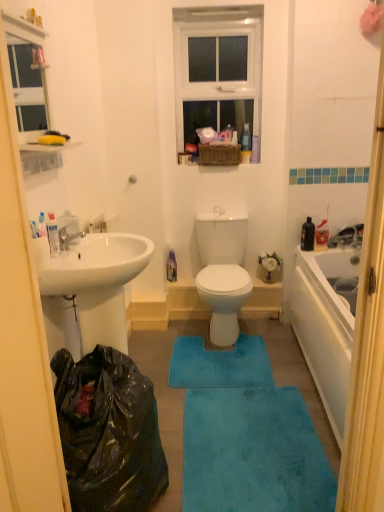
Where is `white plastic window at upper center`? This screenshot has width=384, height=512. white plastic window at upper center is located at coordinates (217, 70).

Looking at this image, measure the distance between black plastic bag at lower left and camera.

black plastic bag at lower left is 4.20 feet away from camera.

How much space does blue plush bath mat at center, which is the 1th bath mat in back-to-front order, occupy horizontally?

blue plush bath mat at center, which is the 1th bath mat in back-to-front order, is 22.28 inches wide.

What do you see at coordinates (220, 364) in the screenshot?
I see `blue plush bath mat at center, which is the 1th bath mat in back-to-front order` at bounding box center [220, 364].

Where is `white plastic window at upper center`? Image resolution: width=384 pixels, height=512 pixels. white plastic window at upper center is located at coordinates (217, 70).

Considering the sizes of objects clear glass window screen at upper left and white plastic toothpaste tube at left in the image provided, who is bigger, clear glass window screen at upper left or white plastic toothpaste tube at left?

clear glass window screen at upper left.

Between clear glass window screen at upper left and white plastic toothpaste tube at left, which one has smaller width?

clear glass window screen at upper left is thinner.

From the image's perspective, would you say clear glass window screen at upper left is shown under white plastic toothpaste tube at left?

Actually, clear glass window screen at upper left appears above white plastic toothpaste tube at left in the image.

Would you say clear glass window screen at upper left contains white plastic toothpaste tube at left?

Definitely not — white plastic toothpaste tube at left is not inside clear glass window screen at upper left.

Who is shorter, clear glass window screen at upper left or matte silver faucet at left?

matte silver faucet at left is shorter.

Based on their sizes in the image, would you say clear glass window screen at upper left is bigger or smaller than matte silver faucet at left?

Considering their sizes, clear glass window screen at upper left takes up more space than matte silver faucet at left.

Is clear glass window screen at upper left looking in the opposite direction of matte silver faucet at left?

No, clear glass window screen at upper left is not facing away from matte silver faucet at left.

Between clear glass window screen at upper left and matte silver faucet at left, which one is positioned in front?

clear glass window screen at upper left is in front.

Which is correct: black plastic bag at lower left is inside blue plush bath mat at center, which ranks as the second bath mat in bottom-to-top order, or outside of it?

black plastic bag at lower left lies outside blue plush bath mat at center, which ranks as the second bath mat in bottom-to-top order.

Considering their positions, is black plastic bag at lower left located in front of or behind blue plush bath mat at center, which appears as the 1th bath mat when viewed from the top?

black plastic bag at lower left is positioned closer to the viewer than blue plush bath mat at center, which appears as the 1th bath mat when viewed from the top.

Is black plastic bag at lower left turned away from blue plush bath mat at center, which is the 1th bath mat in back-to-front order?

black plastic bag at lower left is not turned away from blue plush bath mat at center, which is the 1th bath mat in back-to-front order.

Could you measure the distance between black plastic bag at lower left and blue plush bath mat at center, which is the 1th bath mat in back-to-front order?

black plastic bag at lower left and blue plush bath mat at center, which is the 1th bath mat in back-to-front order, are 31.87 inches apart from each other.

Between blue plush bath mat at center, the 1th bath mat when ordered from bottom to top, and black plastic bag at lower left, which one has more height?

With more height is black plastic bag at lower left.

What's the angular difference between blue plush bath mat at center, which is the 1th bath mat from front to back, and black plastic bag at lower left's facing directions?

The angular difference between blue plush bath mat at center, which is the 1th bath mat from front to back, and black plastic bag at lower left is 89.6 degrees.

Looking at this image, considering the sizes of blue plush bath mat at center, which is the 1th bath mat from front to back, and black plastic bag at lower left in the image, is blue plush bath mat at center, which is the 1th bath mat from front to back, wider or thinner than black plastic bag at lower left?

In the image, blue plush bath mat at center, which is the 1th bath mat from front to back, appears to be wider than black plastic bag at lower left.

Which is behind, point (266, 403) or point (79, 506)?

The point (266, 403) is farther.

Can you confirm if black plastic bag at lower left is shorter than matte silver faucet at left?

No.

Based on their sizes in the image, would you say black plastic bag at lower left is bigger or smaller than matte silver faucet at left?

black plastic bag at lower left is bigger than matte silver faucet at left.

Between black plastic bag at lower left and matte silver faucet at left, which one appears on the left side from the viewer's perspective?

Positioned to the left is matte silver faucet at left.

Is black plastic bag at lower left oriented away from matte silver faucet at left?

No, black plastic bag at lower left is not facing the opposite direction of matte silver faucet at left.

Based on the photo, does blue plush bath mat at center, which appears as the 1th bath mat when viewed from the top, appear on the right side of blue plush bath mat at center, the 2th bath mat from the top?

In fact, blue plush bath mat at center, which appears as the 1th bath mat when viewed from the top, is to the left of blue plush bath mat at center, the 2th bath mat from the top.

Considering the points (271, 386) and (274, 509), which point is behind, point (271, 386) or point (274, 509)?

The point (271, 386) is behind.

Is blue plush bath mat at center, which ranks as the second bath mat in bottom-to-top order, bigger or smaller than blue plush bath mat at center, the 2th bath mat from the top?

blue plush bath mat at center, which ranks as the second bath mat in bottom-to-top order, is smaller than blue plush bath mat at center, the 2th bath mat from the top.

From the picture: From the image's perspective, between blue plush bath mat at center, which is the 1th bath mat in back-to-front order, and blue plush bath mat at center, positioned as the 2th bath mat in back-to-front order, who is located below?

From the image's view, blue plush bath mat at center, positioned as the 2th bath mat in back-to-front order, is below.

How far apart are white plastic window at upper center and matte silver faucet at left?

white plastic window at upper center and matte silver faucet at left are 1.64 meters apart.

Could you tell me if white plastic window at upper center is turned towards matte silver faucet at left?

Yes, white plastic window at upper center faces towards matte silver faucet at left.

Consider the image. From a real-world perspective, is white plastic window at upper center over matte silver faucet at left?

Correct, in the physical world, white plastic window at upper center is higher than matte silver faucet at left.

I want to click on toiletry behind the clear glass window screen at upper left, so click(53, 234).

The height and width of the screenshot is (512, 384). In order to click on window screen on the left side of matte silver faucet at left in this screenshot , I will do `click(27, 87)`.

Based on their spatial positions, is white plastic toothpaste tube at left or blue plush bath mat at center, positioned as the 2th bath mat in back-to-front order, further from matte silver faucet at left?

Based on the image, blue plush bath mat at center, positioned as the 2th bath mat in back-to-front order, appears to be further to matte silver faucet at left.

Estimate the real-world distances between objects in this image. Which object is closer to blue plush bath mat at center, the 2th bath mat from the top, clear glass window screen at upper left or matte silver faucet at left?

matte silver faucet at left lies closer to blue plush bath mat at center, the 2th bath mat from the top, than the other object.

Which object lies nearer to the anchor point black plastic bag at lower left, white plastic toothpaste tube at left or blue plush bath mat at center, which is the 1th bath mat from front to back?

blue plush bath mat at center, which is the 1th bath mat from front to back, lies closer to black plastic bag at lower left than the other object.

Considering their positions, is matte silver faucet at left positioned closer to black plastic bag at lower left than white plastic toothpaste tube at left?

The object closer to black plastic bag at lower left is white plastic toothpaste tube at left.

From the image, which object appears to be farther from blue plush bath mat at center, the 2th bath mat from the top, white plastic toothpaste tube at left or matte silver faucet at left?

Based on the image, white plastic toothpaste tube at left appears to be further to blue plush bath mat at center, the 2th bath mat from the top.

Based on their spatial positions, is matte silver faucet at left or blue plush bath mat at center, which is the second bath mat from front to back, further from white plastic toothpaste tube at left?

blue plush bath mat at center, which is the second bath mat from front to back, lies further to white plastic toothpaste tube at left than the other object.

Looking at this image, from the image, which object appears to be nearer to black plastic bag at lower left, clear glass window screen at upper left or matte silver faucet at left?

matte silver faucet at left is positioned closer to the anchor black plastic bag at lower left.

Consider the image. When comparing their distances from black plastic bag at lower left, does blue plush bath mat at center, which is the 1th bath mat in back-to-front order, or clear glass window screen at upper left seem further?

clear glass window screen at upper left lies further to black plastic bag at lower left than the other object.

This screenshot has height=512, width=384. Find the location of `toiletry between clear glass window screen at upper left and blue plush bath mat at center, the 1th bath mat when ordered from bottom to top, in the vertical direction`. toiletry between clear glass window screen at upper left and blue plush bath mat at center, the 1th bath mat when ordered from bottom to top, in the vertical direction is located at coordinates (53, 234).

I want to click on tap between black plastic bag at lower left and blue plush bath mat at center, which is the 1th bath mat in back-to-front order, in the front-back direction, so click(x=68, y=238).

Image resolution: width=384 pixels, height=512 pixels. Identify the location of tap between clear glass window screen at upper left and blue plush bath mat at center, the 1th bath mat when ordered from bottom to top, in the up-down direction. (68, 238).

Where is `window screen that lies between white plastic window at upper center and black plastic bag at lower left from top to bottom`? The width and height of the screenshot is (384, 512). window screen that lies between white plastic window at upper center and black plastic bag at lower left from top to bottom is located at coordinates (27, 87).